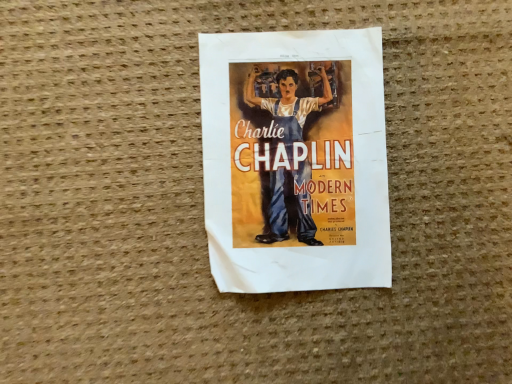
You are a GUI agent. You are given a task and a screenshot of the screen. Output one action in this format:
    pyautogui.click(x=<x>, y=<y>)
    Task: Click on the free location above matte paper poster at center (from a real-world perspective)
    
    Given the screenshot: What is the action you would take?
    pyautogui.click(x=304, y=155)